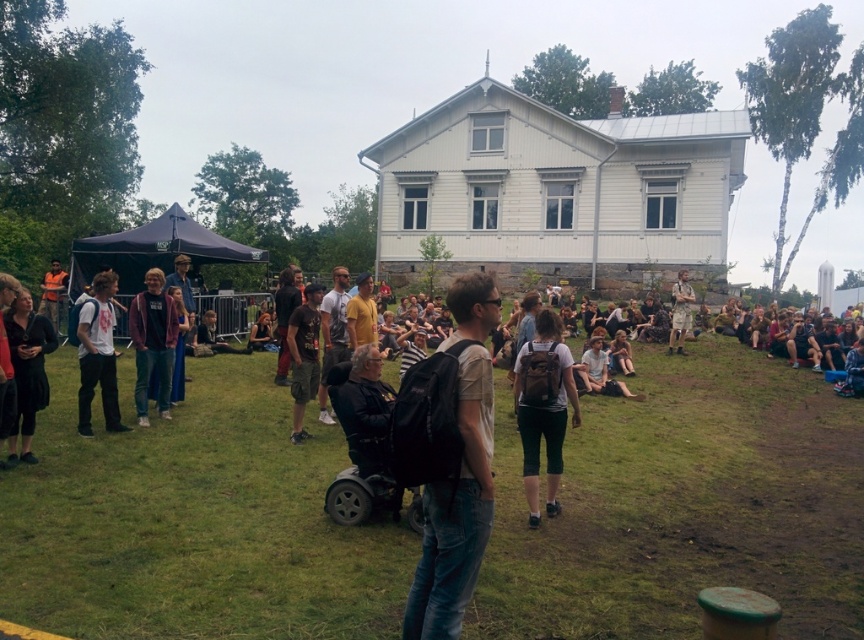
Is matte brown backpack at center behind orange reflective vest at left?

No, matte brown backpack at center is in front of orange reflective vest at left.

Looking at this image, is matte brown backpack at center taller than orange reflective vest at left?

Yes.

Is point (554, 417) positioned behind point (62, 285)?

No, (554, 417) is closer to viewer.

I want to click on matte brown backpack at center, so click(543, 408).

Is the position of dark brown fabric pants at center less distant than that of khaki fabric shorts at center?

That is True.

Who is positioned more to the left, dark brown fabric pants at center or khaki fabric shorts at center?

Positioned to the left is dark brown fabric pants at center.

Does point (299, 312) come in front of point (681, 321)?

Yes, point (299, 312) is in front of point (681, 321).

Identify the location of dark brown fabric pants at center. (303, 356).

Can you confirm if khaki fabric shorts at center is smaller than orange reflective vest at left?

No, khaki fabric shorts at center is not smaller than orange reflective vest at left.

What do you see at coordinates (680, 310) in the screenshot?
I see `khaki fabric shorts at center` at bounding box center [680, 310].

Is point (683, 349) less distant than point (53, 310)?

No, (683, 349) is further to viewer.

You are a GUI agent. You are given a task and a screenshot of the screen. Output one action in this format:
    pyautogui.click(x=<x>, y=<y>)
    Task: Click on the khaki fabric shorts at center
    The image size is (864, 640).
    Given the screenshot: What is the action you would take?
    pyautogui.click(x=680, y=310)